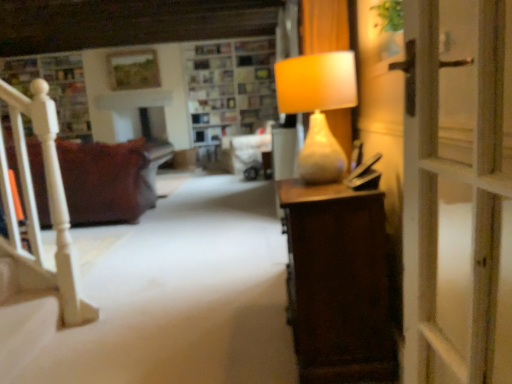
Question: Can you confirm if brown fabric couch at left is taller than matte beige lamp at right?

Choices:
 (A) no
 (B) yes

Answer: (B)

Question: Considering the relative sizes of brown fabric couch at left and matte beige lamp at right in the image provided, is brown fabric couch at left shorter than matte beige lamp at right?

Choices:
 (A) yes
 (B) no

Answer: (B)

Question: From the image's perspective, is brown fabric couch at left located beneath matte beige lamp at right?

Choices:
 (A) yes
 (B) no

Answer: (A)

Question: Does brown fabric couch at left have a lesser width compared to matte beige lamp at right?

Choices:
 (A) yes
 (B) no

Answer: (B)

Question: Can we say brown fabric couch at left lies outside matte beige lamp at right?

Choices:
 (A) no
 (B) yes

Answer: (B)

Question: Is wooden shelves at upper center taller or shorter than matte beige lamp at right?

Choices:
 (A) short
 (B) tall

Answer: (B)

Question: Considering the relative positions of wooden shelves at upper center and matte beige lamp at right in the image provided, is wooden shelves at upper center to the left or to the right of matte beige lamp at right?

Choices:
 (A) right
 (B) left

Answer: (B)

Question: In terms of size, does wooden shelves at upper center appear bigger or smaller than matte beige lamp at right?

Choices:
 (A) small
 (B) big

Answer: (B)

Question: From a real-world perspective, is wooden shelves at upper center above or below matte beige lamp at right?

Choices:
 (A) above
 (B) below

Answer: (A)

Question: Is brown fabric couch at left wider or thinner than matte beige lamp at right?

Choices:
 (A) wide
 (B) thin

Answer: (A)

Question: Is point (106, 195) closer or farther from the camera than point (330, 94)?

Choices:
 (A) closer
 (B) farther

Answer: (B)

Question: From a real-world perspective, is brown fabric couch at left above or below matte beige lamp at right?

Choices:
 (A) above
 (B) below

Answer: (B)

Question: From their relative heights in the image, would you say brown fabric couch at left is taller or shorter than matte beige lamp at right?

Choices:
 (A) short
 (B) tall

Answer: (B)

Question: In terms of height, does matte beige lamp at right look taller or shorter compared to brown fabric couch at left?

Choices:
 (A) tall
 (B) short

Answer: (B)

Question: From the image's perspective, is matte beige lamp at right located above or below brown fabric couch at left?

Choices:
 (A) below
 (B) above

Answer: (B)